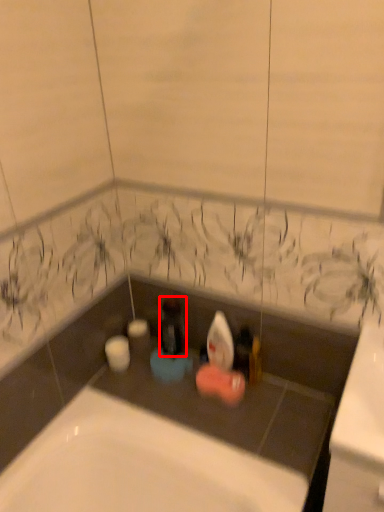
Question: Where is bottle (annotated by the red box) located in relation to toiletry in the image?

Choices:
 (A) left
 (B) right

Answer: (A)